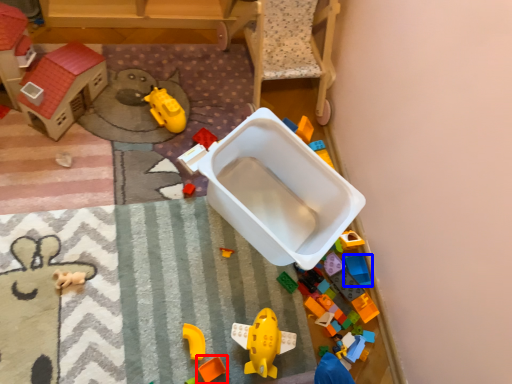
Question: Which object appears farthest to the camera in this image, toy (highlighted by a red box) or toy (highlighted by a blue box)?

Choices:
 (A) toy
 (B) toy

Answer: (B)